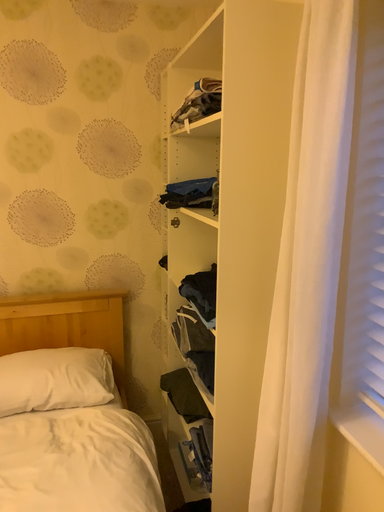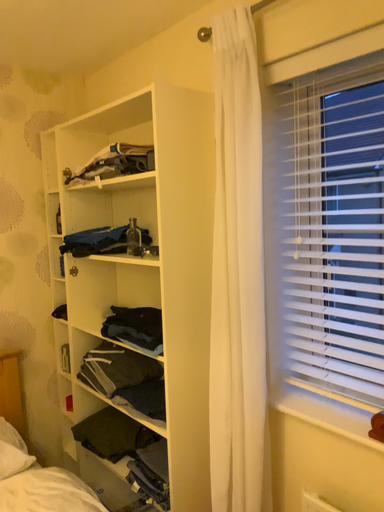
Question: Which way did the camera rotate in the video?

Choices:
 (A) rotated right
 (B) rotated left

Answer: (A)